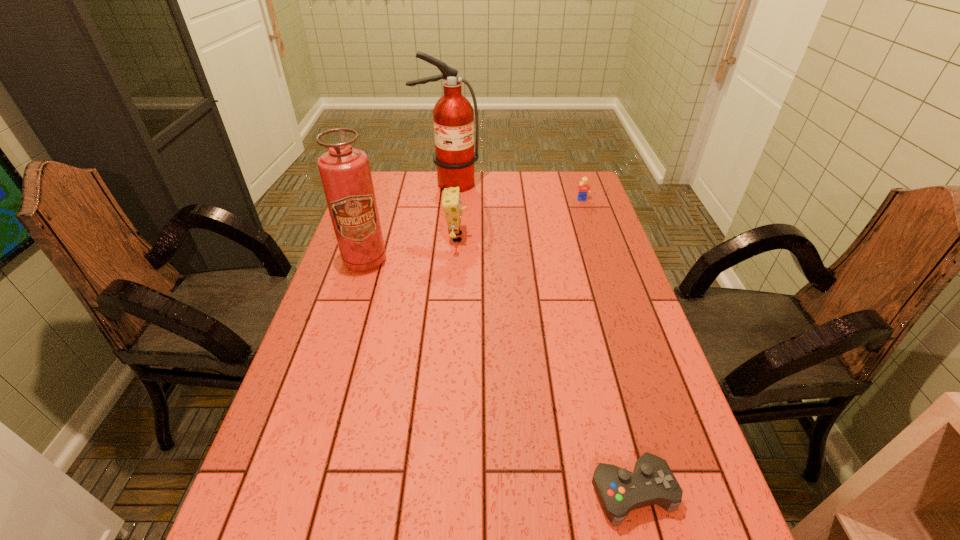
This screenshot has width=960, height=540. I want to click on the right fire extinguisher, so click(x=453, y=115).

Find the location of a particular element. the farther fire extinguisher is located at coordinates (453, 115).

At what (x,y) coordinates should I click in order to perform the action: click on the leftmost object. Please return your answer as a coordinate pair (x, y). This screenshot has height=540, width=960. Looking at the image, I should click on (345, 173).

The image size is (960, 540). I want to click on the shorter fire extinguisher, so click(x=345, y=173).

Identify the location of sponge. Image resolution: width=960 pixels, height=540 pixels. (451, 202).

Identify the location of the fourth nearest object. (584, 188).

Locate an element on the screen. the second shortest object is located at coordinates (584, 188).

You are a GUI agent. You are given a task and a screenshot of the screen. Output one action in this format:
    pyautogui.click(x=<x>, y=<y>)
    Task: Click on the shortest object
    This screenshot has height=540, width=960.
    Given the screenshot: What is the action you would take?
    pyautogui.click(x=619, y=491)

Locate an element on the screen. The height and width of the screenshot is (540, 960). control is located at coordinates (619, 491).

At what (x,y) coordinates should I click in order to perform the action: click on free region located 0.300m on the nozzle and handle of the tallest object. Please return your answer as a coordinate pair (x, y). Image resolution: width=960 pixels, height=540 pixels. Looking at the image, I should click on (442, 241).